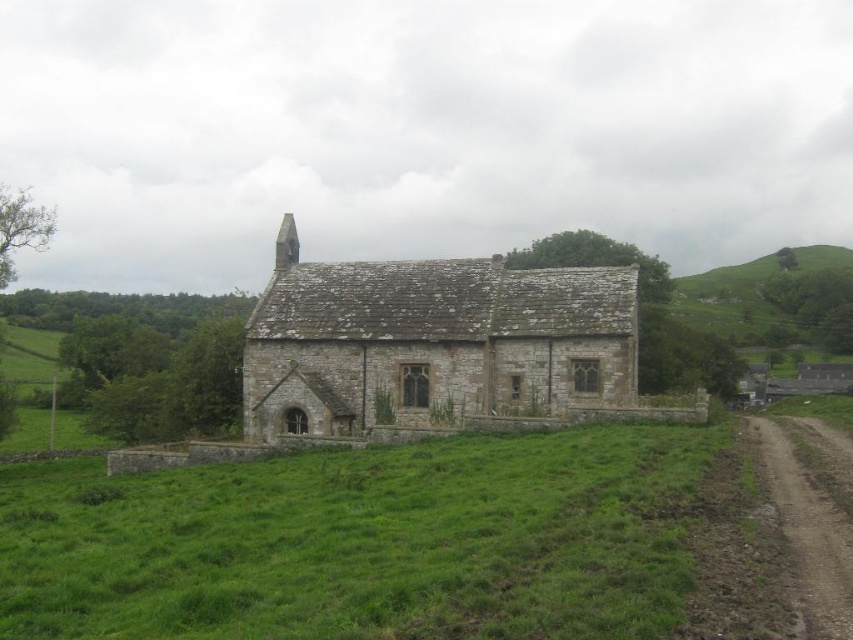
What do you see at coordinates (431, 340) in the screenshot? I see `stone textured church at center` at bounding box center [431, 340].

Is point (585, 368) positioned in front of point (843, 252)?

Yes, it is.

Between point (343, 272) and point (677, 314), which one is positioned behind?

Point (677, 314)

Find the location of a particular element. This screenshot has height=640, width=853. stone textured church at center is located at coordinates click(x=431, y=340).

Consider the image. Between green grassy hillside at upper right and brown dirt track at lower right, which one is positioned higher?

green grassy hillside at upper right is higher up.

Does point (770, 317) lie behind point (822, 536)?

Yes, point (770, 317) is farther from viewer.

Where is `green grassy hillside at upper right`? green grassy hillside at upper right is located at coordinates (766, 296).

Consider the image. Does stone textured church at center appear over brown dirt track at lower right?

Yes, stone textured church at center is above brown dirt track at lower right.

From the picture: Can you confirm if stone textured church at center is shorter than brown dirt track at lower right?

No, stone textured church at center is not shorter than brown dirt track at lower right.

Does point (451, 346) lie behind point (831, 612)?

Yes.

I want to click on stone textured church at center, so click(431, 340).